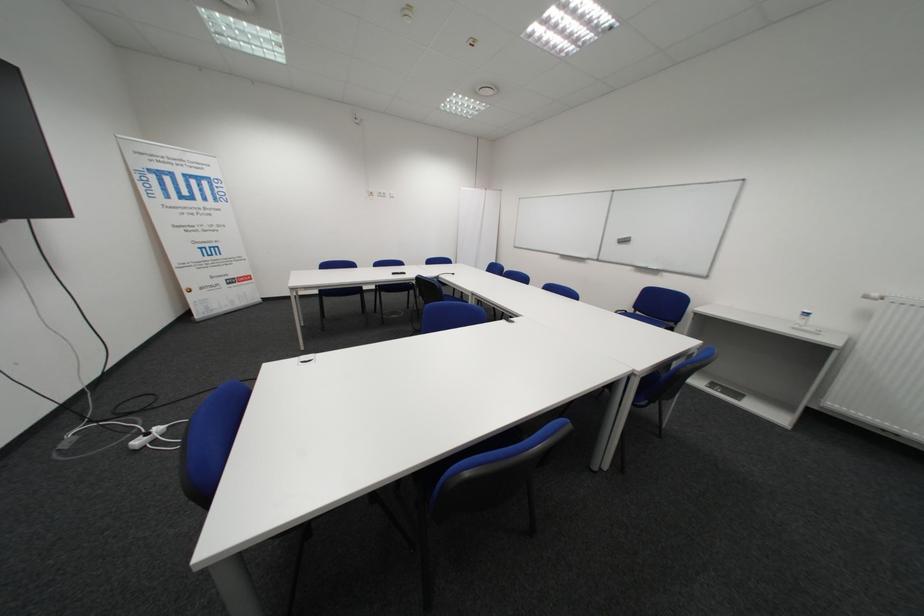
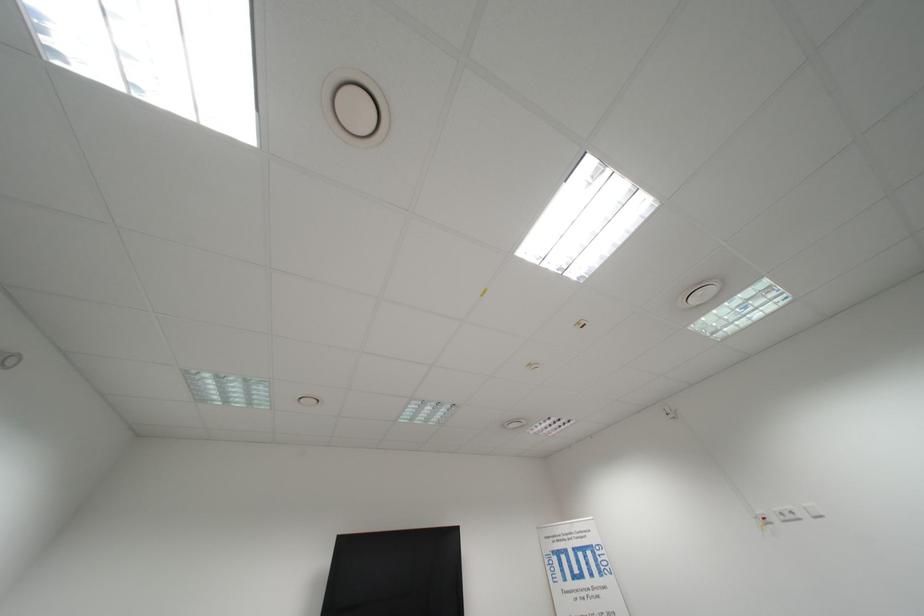
Where in the second image is the point corresponding to point (391, 196) from the first image?

(796, 519)